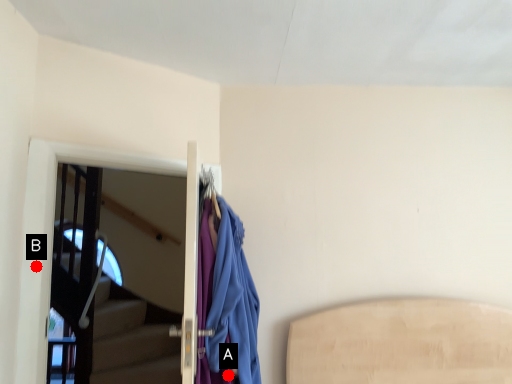
Question: Two points are circled on the image, labeled by A and B beside each circle. Which point is farther to the camera?

Choices:
 (A) A is further
 (B) B is further

Answer: (B)